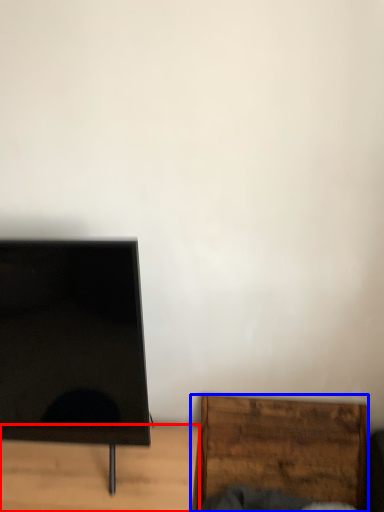
Question: Which of the following is the farthest to the observer, furniture (highlighted by a red box) or furniture (highlighted by a blue box)?

Choices:
 (A) furniture
 (B) furniture

Answer: (B)